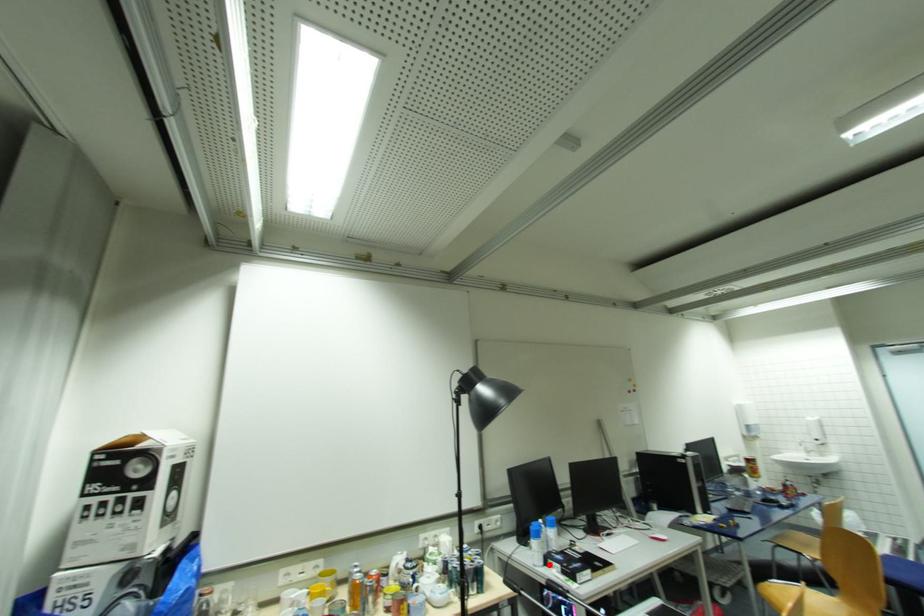
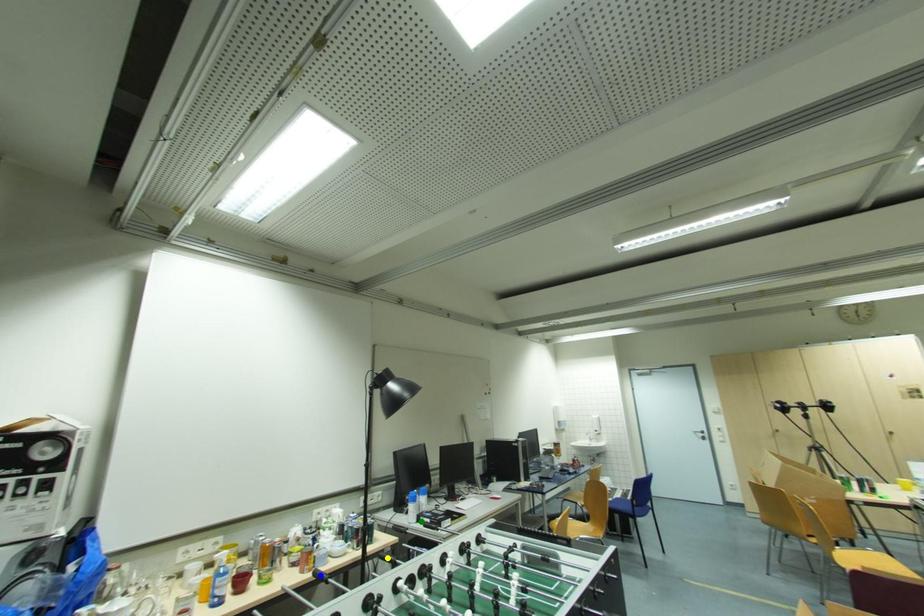
Question: I am providing you with two images of the same scene from different viewpoints. A red point is marked on the first image. You are given multiple points on the second image. Can you choose the point in image 2 that corresponds to the point in image 1?

Choices:
 (A) green point
 (B) yellow point
 (C) blue point

Answer: (A)